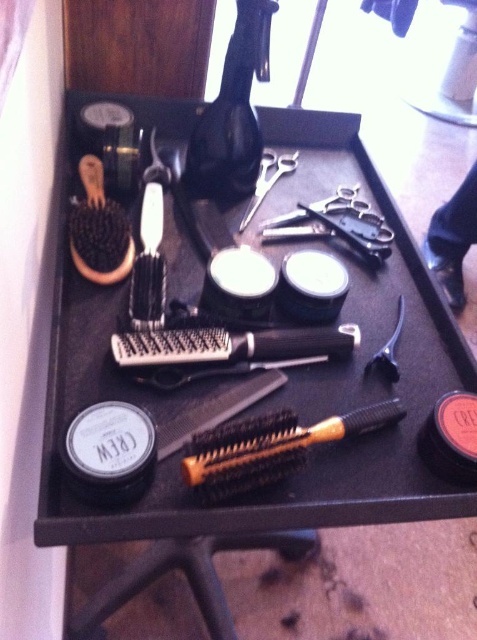
Question: Which point appears closest to the camera in this image?

Choices:
 (A) (245, 460)
 (B) (217, 326)

Answer: (A)

Question: Is gold-bristled brush at center below black plastic comb at center?

Choices:
 (A) no
 (B) yes

Answer: (B)

Question: Does gold-bristled brush at center appear on the right side of black plastic comb at center?

Choices:
 (A) yes
 (B) no

Answer: (A)

Question: Does gold-bristled brush at center appear under black plastic comb at center?

Choices:
 (A) no
 (B) yes

Answer: (B)